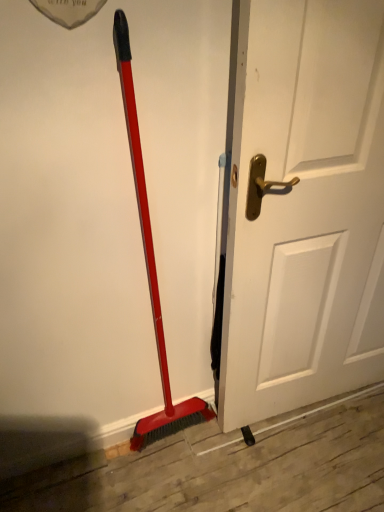
Describe the element at coordinates (304, 207) in the screenshot. The width and height of the screenshot is (384, 512). I see `white matte door at center` at that location.

Measure the distance between white matte door at center and camera.

A distance of 81.36 centimeters exists between white matte door at center and camera.

Identify the location of white matte door at center. (304, 207).

At what (x,y) coordinates should I click in order to perform the action: click on white matte door at center. Please return your answer as a coordinate pair (x, y). Looking at the image, I should click on (304, 207).